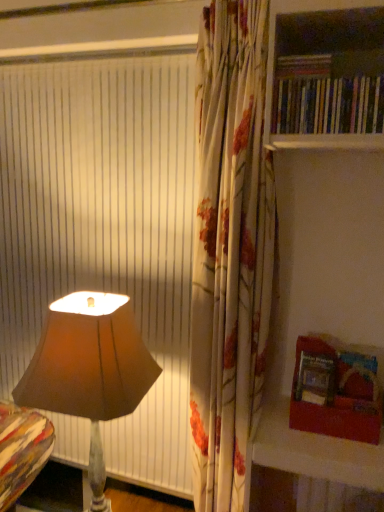
Question: Is wooden bookshelf at right not within hardcover books at upper right, acting as the 2th book starting from the top?

Choices:
 (A) yes
 (B) no

Answer: (A)

Question: Is wooden bookshelf at right further to camera compared to hardcover books at upper right, which ranks as the 1th book in bottom-to-top order?

Choices:
 (A) yes
 (B) no

Answer: (B)

Question: From a real-world perspective, is wooden bookshelf at right over hardcover books at upper right, which ranks as the 1th book in bottom-to-top order?

Choices:
 (A) yes
 (B) no

Answer: (A)

Question: From the image's perspective, is wooden bookshelf at right under hardcover books at upper right, which ranks as the 1th book in bottom-to-top order?

Choices:
 (A) yes
 (B) no

Answer: (B)

Question: Can you confirm if wooden bookshelf at right is bigger than hardcover books at upper right, acting as the 2th book starting from the top?

Choices:
 (A) yes
 (B) no

Answer: (A)

Question: Does point (306, 368) appear closer or farther from the camera than point (306, 75)?

Choices:
 (A) closer
 (B) farther

Answer: (B)

Question: Considering the positions of hardcover book at lower right and hardcover book at upper right, acting as the second book starting from the bottom, in the image, is hardcover book at lower right wider or thinner than hardcover book at upper right, acting as the second book starting from the bottom,?

Choices:
 (A) thin
 (B) wide

Answer: (A)

Question: Visually, is hardcover book at lower right positioned to the left or to the right of hardcover book at upper right, which ranks as the first book in top-to-bottom order?

Choices:
 (A) right
 (B) left

Answer: (A)

Question: In terms of height, does hardcover book at lower right look taller or shorter compared to hardcover book at upper right, which ranks as the first book in top-to-bottom order?

Choices:
 (A) tall
 (B) short

Answer: (A)

Question: In the image, is brown fabric lamp at left positioned in front of or behind wooden bookshelf at right?

Choices:
 (A) front
 (B) behind

Answer: (B)

Question: From a real-world perspective, relative to wooden bookshelf at right, is brown fabric lamp at left vertically above or below?

Choices:
 (A) below
 (B) above

Answer: (A)

Question: Does point (71, 351) appear closer or farther from the camera than point (299, 119)?

Choices:
 (A) farther
 (B) closer

Answer: (A)

Question: From their relative heights in the image, would you say brown fabric lamp at left is taller or shorter than wooden bookshelf at right?

Choices:
 (A) short
 (B) tall

Answer: (B)

Question: From a real-world perspective, relative to hardcover books at upper right, acting as the 2th book starting from the top, is hardcover book at lower right vertically above or below?

Choices:
 (A) below
 (B) above

Answer: (A)

Question: Is hardcover book at lower right spatially inside hardcover books at upper right, acting as the 2th book starting from the top, or outside of it?

Choices:
 (A) outside
 (B) inside

Answer: (A)